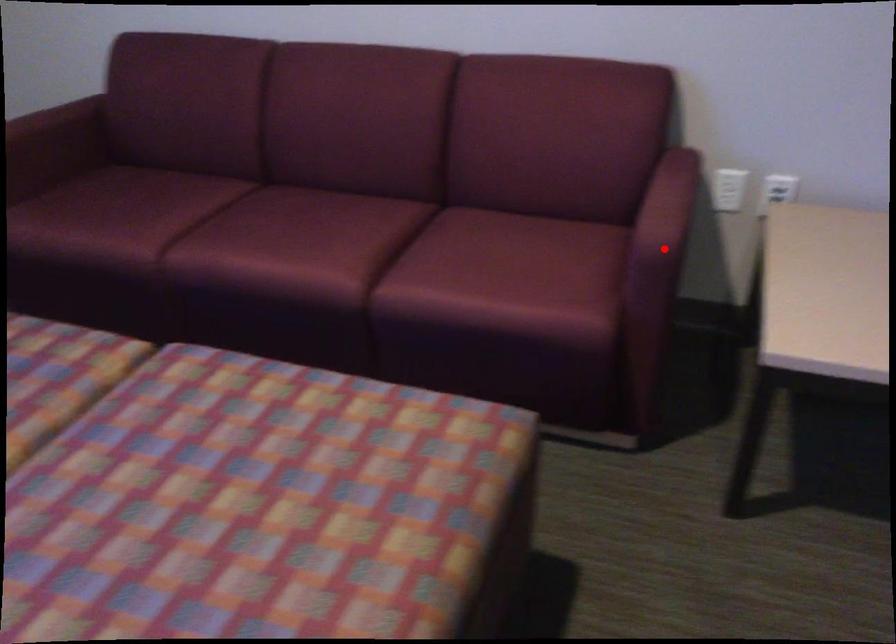
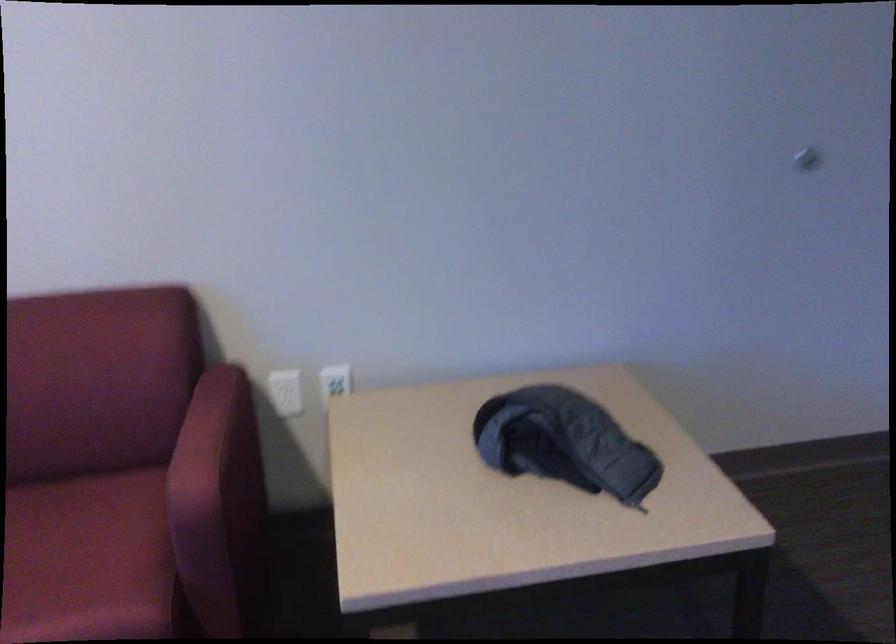
Question: I am providing you with two images of the same scene from different viewpoints. A red point is shown in image1. For the corresponding object point in image2, is it positioned nearer or farther from the camera?

Choices:
 (A) Nearer
 (B) Farther

Answer: (A)